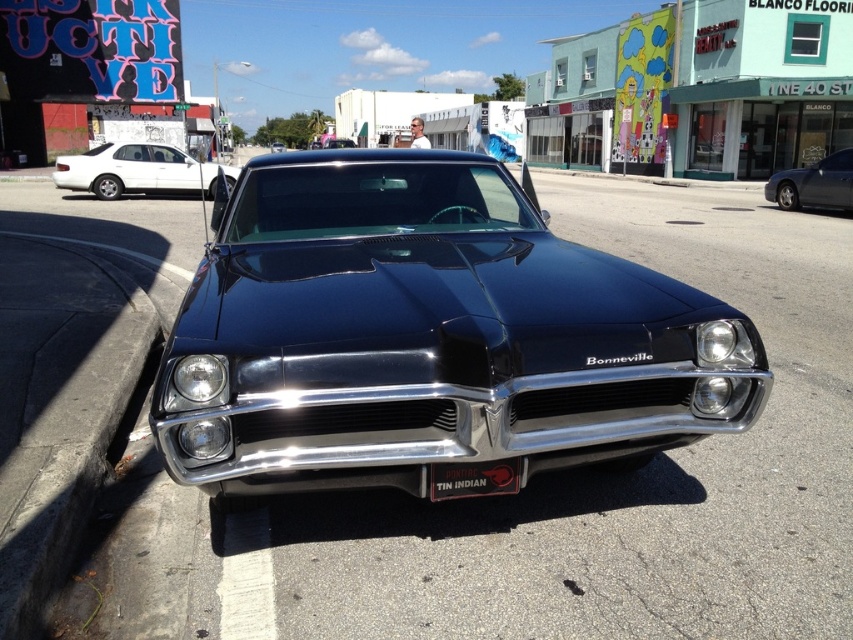
Question: Does shiny black car at center appear over white glossy sedan at upper left?

Choices:
 (A) no
 (B) yes

Answer: (A)

Question: Estimate the real-world distances between objects in this image. Which object is closer to the black matte license plate at center?

Choices:
 (A) shiny black car at center
 (B) white glossy sedan at upper left
 (C) satin black sedan at right

Answer: (A)

Question: Does satin black sedan at right have a larger size compared to black matte license plate at center?

Choices:
 (A) no
 (B) yes

Answer: (B)

Question: Is satin black sedan at right wider than black matte license plate at center?

Choices:
 (A) no
 (B) yes

Answer: (B)

Question: Among these objects, which one is nearest to the camera?

Choices:
 (A) shiny black car at center
 (B) white glossy sedan at upper left
 (C) satin black sedan at right
 (D) black matte license plate at center

Answer: (A)

Question: Which object is positioned closest to the shiny black car at center?

Choices:
 (A) white glossy sedan at upper left
 (B) satin black sedan at right
 (C) black matte license plate at center

Answer: (C)